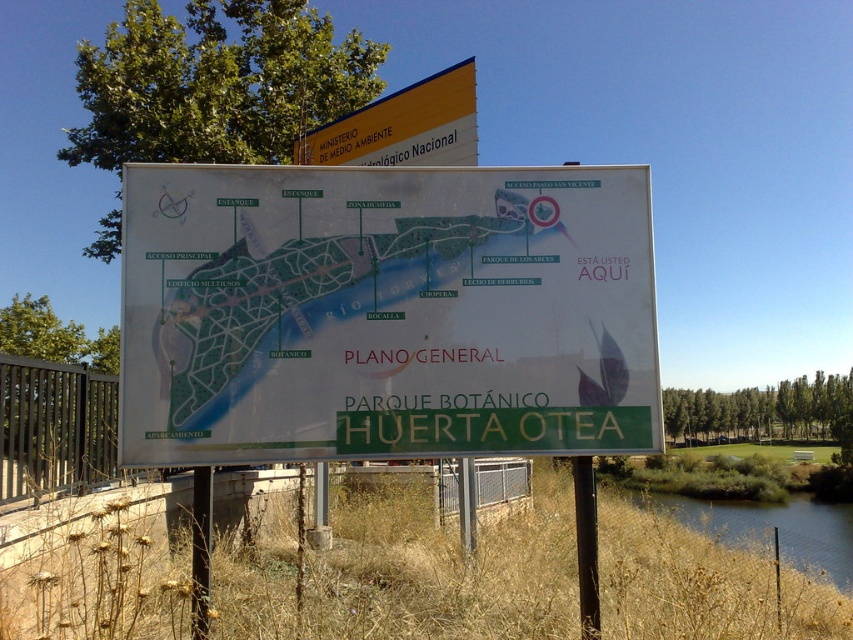
Can you confirm if white paper map at center is shorter than yellow plastic sign at upper center?

Incorrect, white paper map at center's height does not fall short of yellow plastic sign at upper center's.

Based on the photo, is white paper map at center below yellow plastic sign at upper center?

Indeed, white paper map at center is positioned under yellow plastic sign at upper center.

Is point (445, 342) positioned in front of point (442, 145)?

Yes, it is.

This screenshot has height=640, width=853. I want to click on white paper map at center, so click(386, 312).

This screenshot has height=640, width=853. What do you see at coordinates (386, 312) in the screenshot? I see `white paper map at center` at bounding box center [386, 312].

Between white paper map at center and green grassy river at lower right, which one is positioned higher?

white paper map at center is higher up.

What do you see at coordinates (386, 312) in the screenshot? I see `white paper map at center` at bounding box center [386, 312].

The height and width of the screenshot is (640, 853). Find the location of `white paper map at center`. white paper map at center is located at coordinates (386, 312).

Between yellow plastic sign at upper center and green grassy river at lower right, which one appears on the right side from the viewer's perspective?

From the viewer's perspective, green grassy river at lower right appears more on the right side.

Between yellow plastic sign at upper center and green grassy river at lower right, which one has less height?

Standing shorter between the two is yellow plastic sign at upper center.

This screenshot has width=853, height=640. Identify the location of yellow plastic sign at upper center. (403, 125).